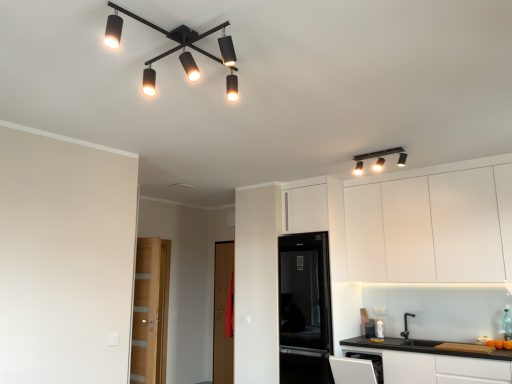
Where is `empty space that is ontop of matte black light fixture at upper left (from a real-world perspective)`? empty space that is ontop of matte black light fixture at upper left (from a real-world perspective) is located at coordinates pos(169,23).